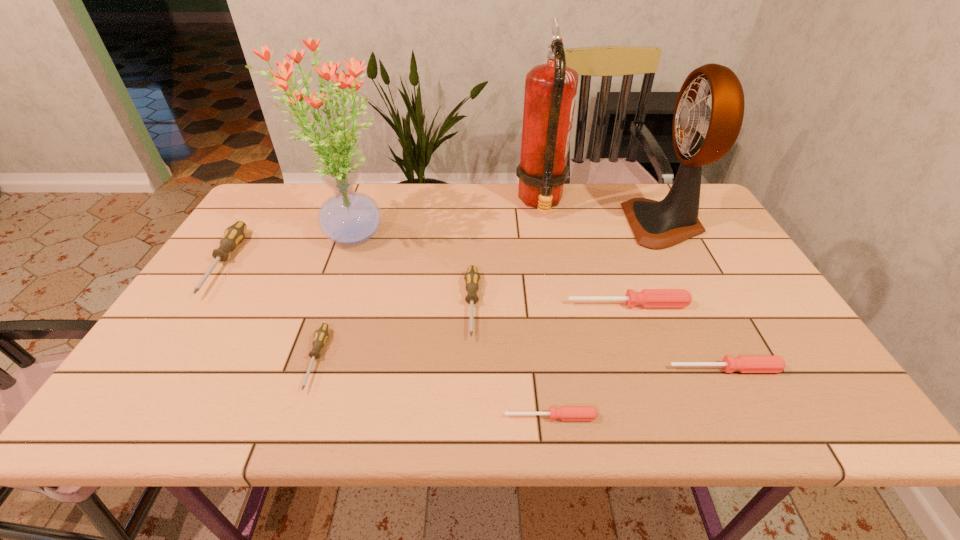
Locate an element on the screen. This screenshot has height=540, width=960. the smallest gray screwdriver is located at coordinates (321, 334).

Where is `the nearest screwdriver`? the nearest screwdriver is located at coordinates (566, 413).

Where is `the shortest screwdriver`? The image size is (960, 540). the shortest screwdriver is located at coordinates (566, 413).

The height and width of the screenshot is (540, 960). Identify the location of vacant space located 0.390m at the nozzle of the fire extinguisher. (396, 202).

Locate an element on the screen. The image size is (960, 540). free space located at the nozzle of the fire extinguisher is located at coordinates (442, 202).

At what (x,y) coordinates should I click in order to perform the action: click on free space located 0.390m at the nozzle of the fire extinguisher. Please return your answer as a coordinate pair (x, y). Looking at the image, I should click on (396, 202).

I want to click on free space located 0.210m on the front of the flower arrangement, so click(316, 325).

Where is `vacant space located 0.390m on the front-facing side of the fan`? The image size is (960, 540). vacant space located 0.390m on the front-facing side of the fan is located at coordinates (501, 224).

At what (x,y) coordinates should I click in order to perform the action: click on blank space located on the front-facing side of the fan. Please return your answer as a coordinate pair (x, y). The height and width of the screenshot is (540, 960). Looking at the image, I should click on (586, 224).

Where is `vacant space situated on the front-facing side of the fan`? vacant space situated on the front-facing side of the fan is located at coordinates (596, 224).